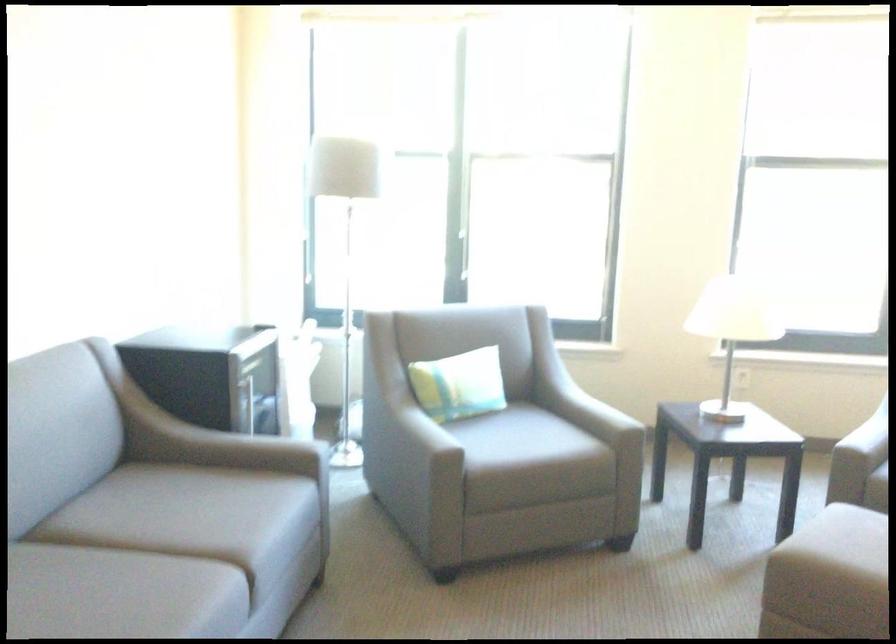
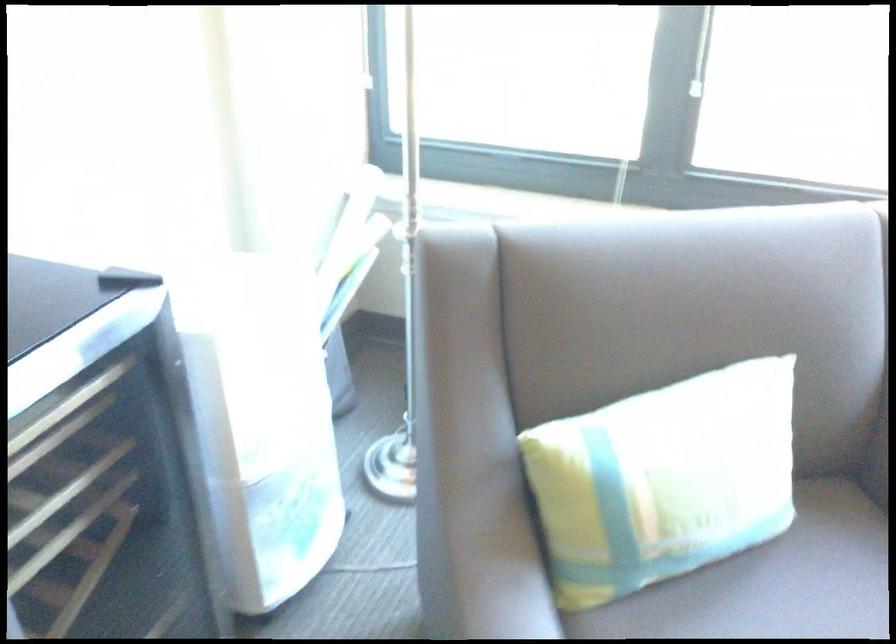
Question: In a continuous first-person perspective shot, in which direction is the camera moving?

Choices:
 (A) Left
 (B) Right
 (C) Forward
 (D) Backward

Answer: (C)